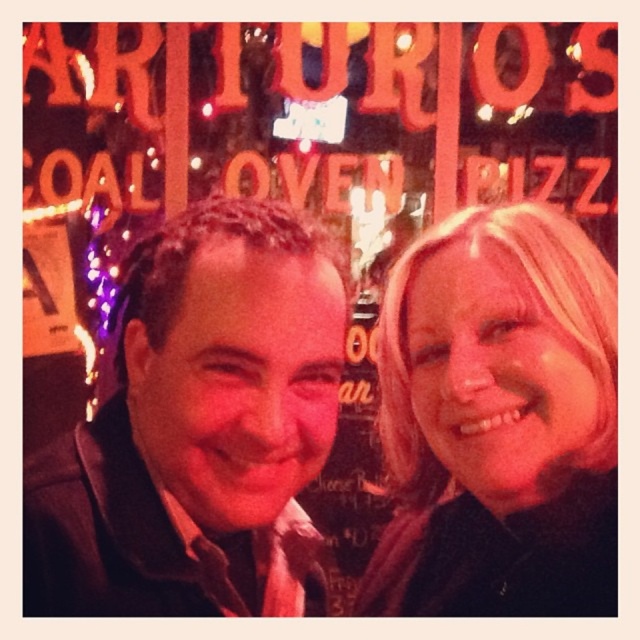
Can you confirm if matte black jacket at center is positioned to the left of blonde hair at upper right?

Yes, matte black jacket at center is to the left of blonde hair at upper right.

Which is in front, point (116, 596) or point (465, 324)?

Point (116, 596) is more forward.

Is point (80, 531) farther from camera compared to point (444, 449)?

No, (80, 531) is in front of (444, 449).

This screenshot has height=640, width=640. I want to click on matte black jacket at center, so (x=195, y=424).